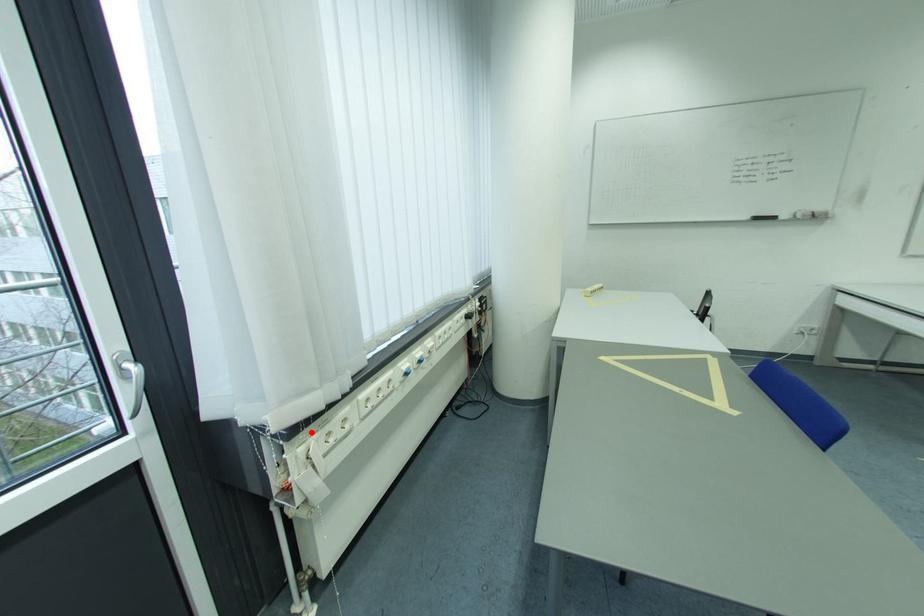
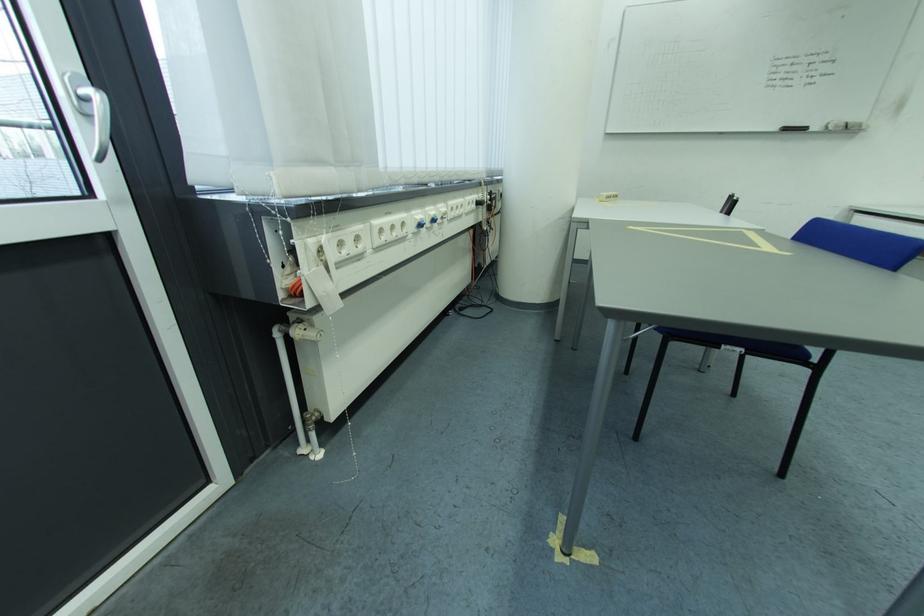
Question: I am providing you with two images of the same scene from different viewpoints. A red point is marked on the first image. Is the red point's position out of view in image 2?

Choices:
 (A) Yes
 (B) No

Answer: (B)